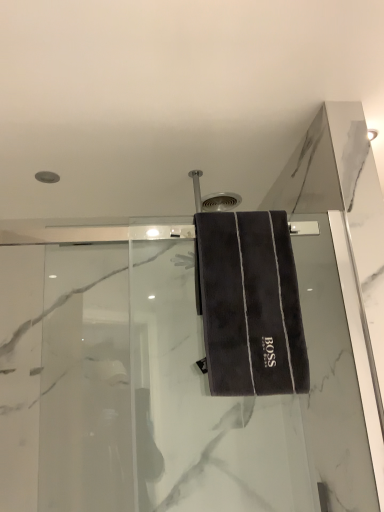
Based on the photo, what is the approximate width of dark gray plush towel at center?

It is 5.22 inches.

Describe the element at coordinates (249, 304) in the screenshot. I see `dark gray plush towel at center` at that location.

In order to click on dark gray plush towel at center in this screenshot , I will do `click(249, 304)`.

I want to click on dark gray plush towel at center, so click(x=249, y=304).